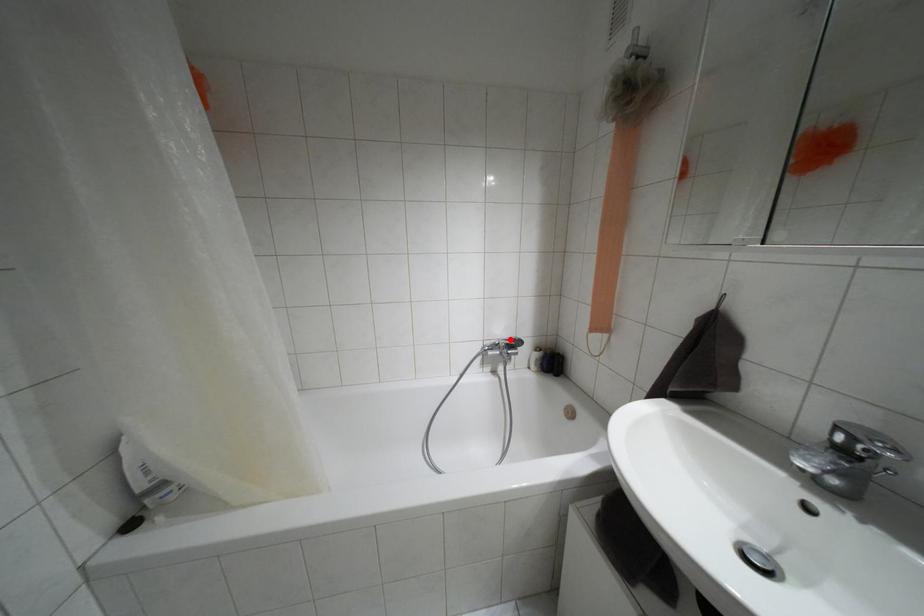
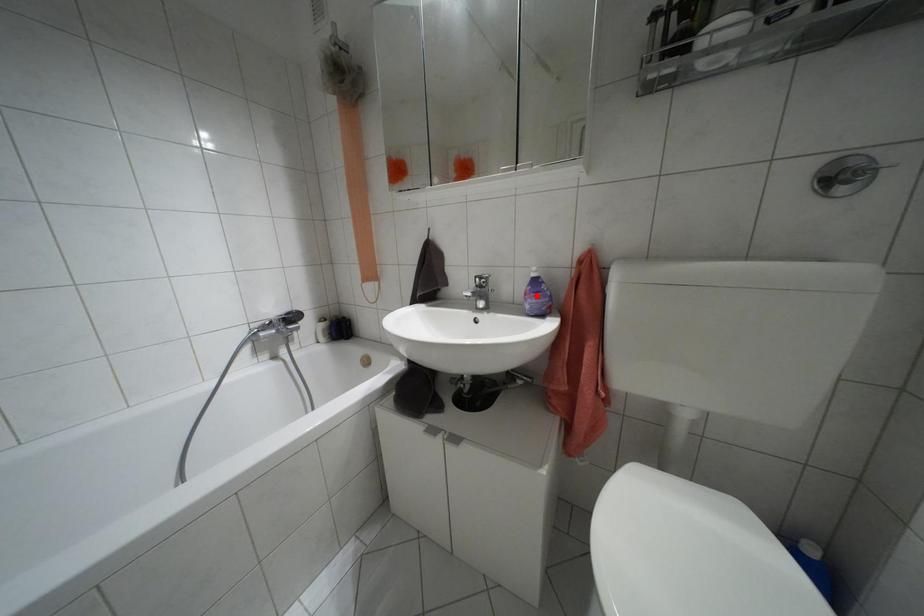
I am providing you with two images of the same scene from different viewpoints. A red point is marked on the first image and another point is marked on the second image. Do the highlighted points in image1 and image2 indicate the same real-world spot?

No